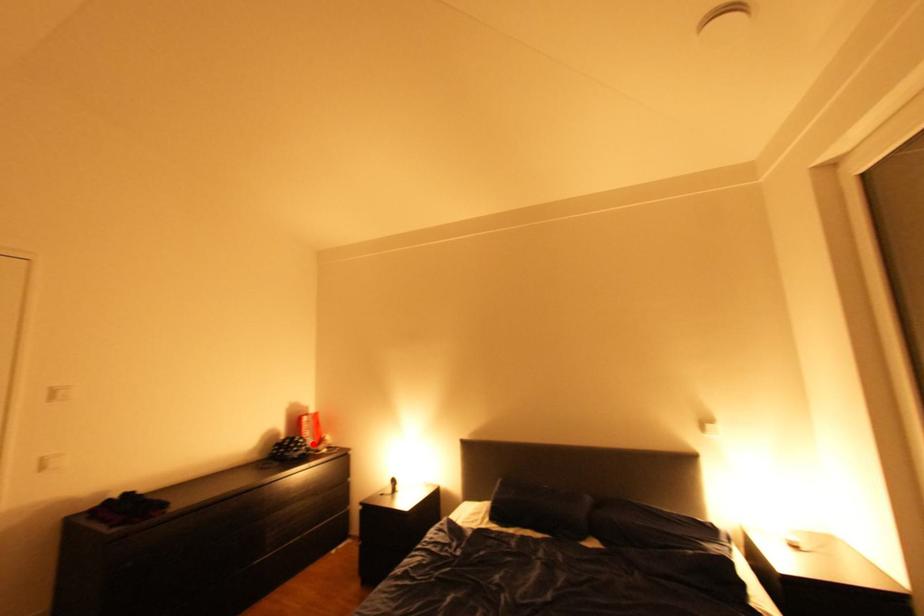
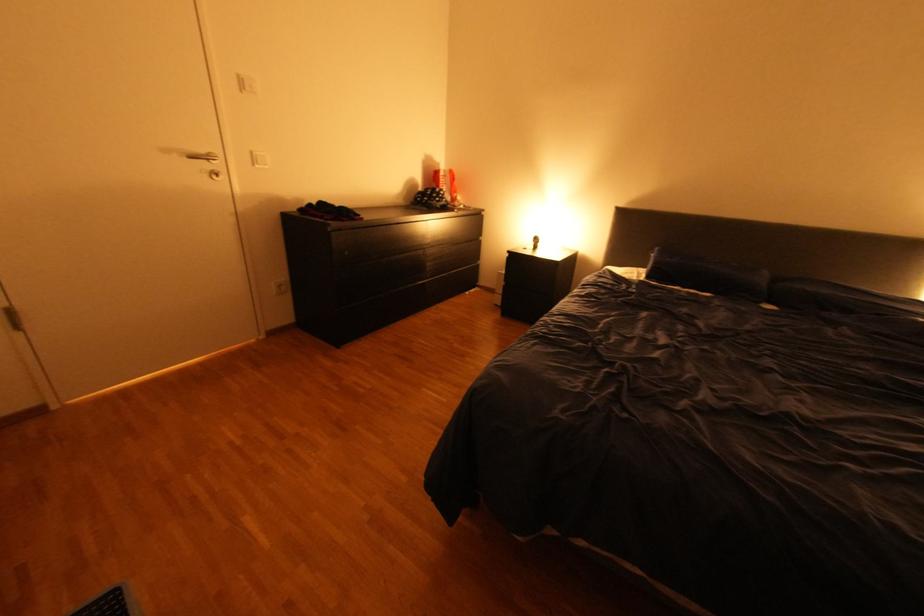
Question: I am providing you with two images of the same scene from different viewpoints. In image1, a red point is highlighted. Considering the same 3D point in image2, which of the following is correct?

Choices:
 (A) It is closer
 (B) It is farther

Answer: (A)